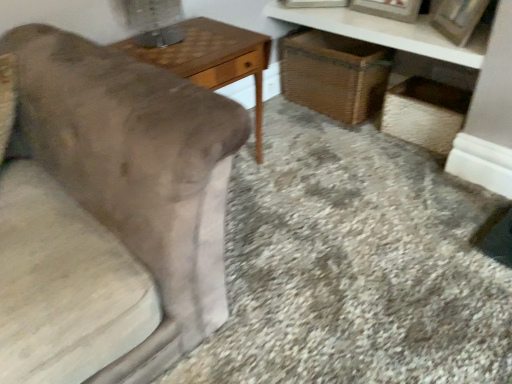
Question: Is woven straw basket at lower right at the right side of velvet beige couch at left?

Choices:
 (A) yes
 (B) no

Answer: (A)

Question: Is woven straw basket at lower right surrounding velvet beige couch at left?

Choices:
 (A) yes
 (B) no

Answer: (B)

Question: Can you see woven straw basket at lower right touching velvet beige couch at left?

Choices:
 (A) no
 (B) yes

Answer: (A)

Question: Is woven straw basket at lower right looking in the opposite direction of velvet beige couch at left?

Choices:
 (A) yes
 (B) no

Answer: (B)

Question: Does woven straw basket at lower right have a smaller size compared to velvet beige couch at left?

Choices:
 (A) yes
 (B) no

Answer: (A)

Question: Based on their sizes in the image, would you say woodenobject at left is bigger or smaller than woven straw basket at lower right?

Choices:
 (A) big
 (B) small

Answer: (A)

Question: Considering their positions, is woodenobject at left located in front of or behind woven straw basket at lower right?

Choices:
 (A) front
 (B) behind

Answer: (A)

Question: From a real-world perspective, relative to woven straw basket at lower right, is woodenobject at left vertically above or below?

Choices:
 (A) above
 (B) below

Answer: (A)

Question: In terms of height, does woodenobject at left look taller or shorter compared to woven straw basket at lower right?

Choices:
 (A) tall
 (B) short

Answer: (A)

Question: Is woven wicker vanity at upper right in front of or behind brown wicker basket at center in the image?

Choices:
 (A) behind
 (B) front

Answer: (B)

Question: Choose the correct answer: Is woven wicker vanity at upper right inside brown wicker basket at center or outside it?

Choices:
 (A) inside
 (B) outside

Answer: (B)

Question: Considering the positions of woven wicker vanity at upper right and brown wicker basket at center in the image, is woven wicker vanity at upper right taller or shorter than brown wicker basket at center?

Choices:
 (A) short
 (B) tall

Answer: (A)

Question: Is woven wicker vanity at upper right to the left or to the right of brown wicker basket at center in the image?

Choices:
 (A) right
 (B) left

Answer: (A)

Question: Is woven straw basket at lower right taller or shorter than wooden picture frame at upper right?

Choices:
 (A) short
 (B) tall

Answer: (B)

Question: From a real-world perspective, is woven straw basket at lower right above or below wooden picture frame at upper right?

Choices:
 (A) below
 (B) above

Answer: (A)